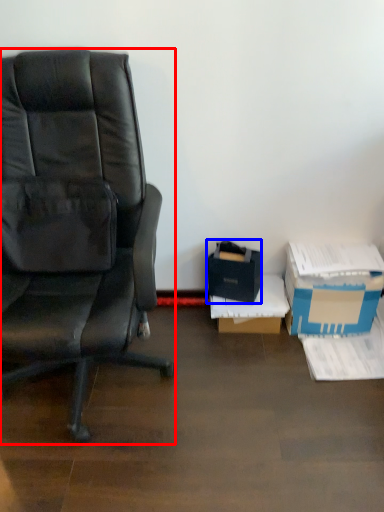
Question: Which point is further to the camera, chair (highlighted by a red box) or box (highlighted by a blue box)?

Choices:
 (A) chair
 (B) box

Answer: (B)